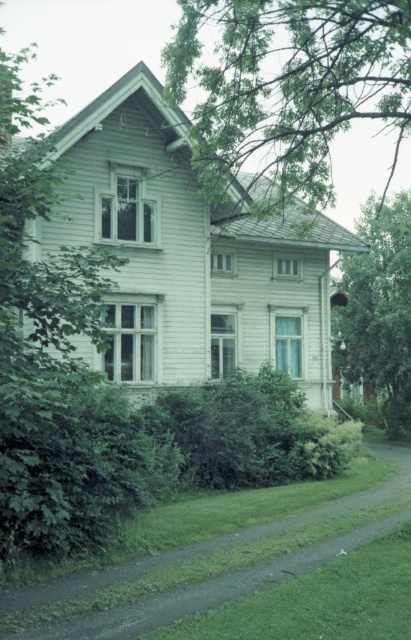
Does green leafy tree at upper center have a lesser height compared to green grassy driveway at lower center?

No, green leafy tree at upper center is not shorter than green grassy driveway at lower center.

Between green leafy tree at upper center and green grassy driveway at lower center, which one is positioned lower?

green grassy driveway at lower center is below.

Where is `green leafy tree at upper center`? green leafy tree at upper center is located at coordinates (290, 83).

Find the location of a particular element. green leafy tree at upper center is located at coordinates (290, 83).

Can you confirm if green grassy driveway at lower center is positioned to the left of green leafy tree at right?

Indeed, green grassy driveway at lower center is positioned on the left side of green leafy tree at right.

Who is higher up, green grassy driveway at lower center or green leafy tree at right?

green leafy tree at right is higher up.

Identify the location of green grassy driveway at lower center. This screenshot has width=411, height=640. (214, 564).

You are a GUI agent. You are given a task and a screenshot of the screen. Output one action in this format:
    pyautogui.click(x=<x>, y=<y>)
    Task: Click on the green grassy driveway at lower center
    The image size is (411, 640).
    Given the screenshot: What is the action you would take?
    pyautogui.click(x=214, y=564)

Does green leafy tree at upper center appear under green leafy tree at right?

Actually, green leafy tree at upper center is above green leafy tree at right.

Is point (399, 70) behind point (399, 428)?

That is False.

Who is more forward, (x=397, y=131) or (x=360, y=228)?

Point (x=360, y=228) is more forward.

Identify the location of green leafy tree at upper center. (290, 83).